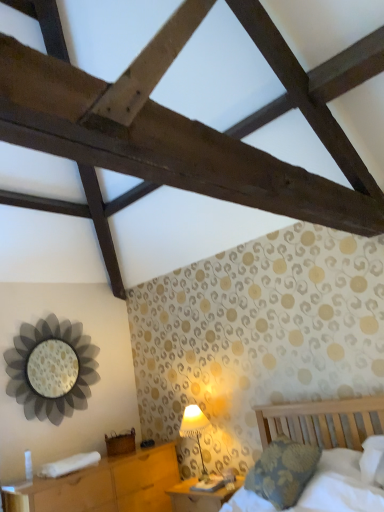
At what (x,y) coordinates should I click in order to perform the action: click on metallic flower-shaped mirror at left. Please return your answer as a coordinate pair (x, y). This screenshot has width=384, height=512. Looking at the image, I should click on pos(51,368).

What do you see at coordinates (51, 368) in the screenshot?
I see `metallic flower-shaped mirror at left` at bounding box center [51, 368].

What is the approximate height of wooden bed at lower right?

44.03 centimeters.

Where is `wooden nightstand at lower left, which appears as the first nightstand when viewed from the left`? wooden nightstand at lower left, which appears as the first nightstand when viewed from the left is located at coordinates (104, 486).

Identify the location of wooden nightstand at lower center, positioned as the 2th nightstand in left-to-right order. (200, 496).

Find the location of a particular element. white fabric lampshade at lower center is located at coordinates (195, 430).

Where is `metallic flower-shaped mirror at left`? metallic flower-shaped mirror at left is located at coordinates (51, 368).

Who is more distant, wooden nightstand at lower left, the 2th nightstand when ordered from right to left, or wooden bed at lower right?

wooden nightstand at lower left, the 2th nightstand when ordered from right to left, is further from the camera.

Who is smaller, wooden nightstand at lower left, the 2th nightstand when ordered from right to left, or wooden bed at lower right?

Smaller between the two is wooden bed at lower right.

How different are the orientations of wooden nightstand at lower left, the 2th nightstand when ordered from right to left, and wooden bed at lower right in degrees?

They differ by 99.2 degrees in their facing directions.

At what (x,y) coordinates should I click in order to perform the action: click on bed lying on the right of wooden nightstand at lower left, the 2th nightstand when ordered from right to left. Please return your answer as a coordinate pair (x, y). The width and height of the screenshot is (384, 512). Looking at the image, I should click on (330, 446).

Looking at the image, does wooden bed at lower right seem bigger or smaller compared to wooden nightstand at lower left, which appears as the first nightstand when viewed from the left?

Considering their sizes, wooden bed at lower right takes up less space than wooden nightstand at lower left, which appears as the first nightstand when viewed from the left.

Looking at their sizes, would you say wooden bed at lower right is wider or thinner than wooden nightstand at lower left, which appears as the first nightstand when viewed from the left?

In the image, wooden bed at lower right appears to be more narrow than wooden nightstand at lower left, which appears as the first nightstand when viewed from the left.

From a real-world perspective, is white fabric lampshade at lower center positioned over wooden nightstand at lower left, which appears as the first nightstand when viewed from the left, based on gravity?

Yes, from a real-world perspective, white fabric lampshade at lower center is above wooden nightstand at lower left, which appears as the first nightstand when viewed from the left.

Is white fabric lampshade at lower center positioned far away from wooden nightstand at lower left, the 2th nightstand when ordered from right to left?

white fabric lampshade at lower center is actually quite close to wooden nightstand at lower left, the 2th nightstand when ordered from right to left.

Identify the location of table lamp located behind the wooden nightstand at lower left, which appears as the first nightstand when viewed from the left. Image resolution: width=384 pixels, height=512 pixels. click(195, 430).

Based on their positions, is white fabric lampshade at lower center located to the left or right of wooden nightstand at lower left, the 2th nightstand when ordered from right to left?

From the image, it's evident that white fabric lampshade at lower center is to the right of wooden nightstand at lower left, the 2th nightstand when ordered from right to left.

Is metallic flower-shaped mirror at left oriented away from white fabric lampshade at lower center?

No.

Which is in front, point (70, 383) or point (203, 414)?

The point (203, 414) is in front.

In the image, is metallic flower-shaped mirror at left positioned in front of or behind white fabric lampshade at lower center?

In the image, metallic flower-shaped mirror at left appears behind white fabric lampshade at lower center.

Is metallic flower-shaped mirror at left next to white fabric lampshade at lower center?

No, metallic flower-shaped mirror at left is not with white fabric lampshade at lower center.

Where is `the 1st nightstand in front when counting from the white fabric lampshade at lower center`? This screenshot has width=384, height=512. the 1st nightstand in front when counting from the white fabric lampshade at lower center is located at coordinates (200, 496).

Can you tell me how much wooden nightstand at lower center, positioned as the 2th nightstand in left-to-right order, and white fabric lampshade at lower center differ in facing direction?

The facing directions of wooden nightstand at lower center, positioned as the 2th nightstand in left-to-right order, and white fabric lampshade at lower center are 0.789 degrees apart.

From a real-world perspective, between wooden nightstand at lower center, positioned as the 2th nightstand in left-to-right order, and white fabric lampshade at lower center, who is vertically higher?

In real-world perspective, white fabric lampshade at lower center is above.

Is wooden nightstand at lower center, positioned as the 2th nightstand in left-to-right order, oriented towards white fabric lampshade at lower center?

No, wooden nightstand at lower center, positioned as the 2th nightstand in left-to-right order, is not oriented towards white fabric lampshade at lower center.

Between white fabric lampshade at lower center and wooden nightstand at lower center, positioned as the 2th nightstand in left-to-right order, which one has more height?

Standing taller between the two is white fabric lampshade at lower center.

Considering the relative sizes of white fabric lampshade at lower center and wooden nightstand at lower center, which ranks as the 1th nightstand in right-to-left order, in the image provided, is white fabric lampshade at lower center bigger than wooden nightstand at lower center, which ranks as the 1th nightstand in right-to-left order,?

No.

Is point (193, 433) farther from camera compared to point (203, 500)?

Yes, point (193, 433) is farther from viewer.

Is white fabric lampshade at lower center not close to wooden nightstand at lower center, which ranks as the 1th nightstand in right-to-left order?

No.

Does wooden bed at lower right have a greater height compared to wooden nightstand at lower center, positioned as the 2th nightstand in left-to-right order?

Yes, wooden bed at lower right is taller than wooden nightstand at lower center, positioned as the 2th nightstand in left-to-right order.

Does point (223, 506) come farther from viewer compared to point (192, 484)?

No, it is in front of (192, 484).

From a real-world perspective, who is located higher, wooden bed at lower right or wooden nightstand at lower center, positioned as the 2th nightstand in left-to-right order?

wooden bed at lower right, from a real-world perspective.

Is wooden bed at lower right aimed at wooden nightstand at lower center, which ranks as the 1th nightstand in right-to-left order?

No, wooden bed at lower right does not turn towards wooden nightstand at lower center, which ranks as the 1th nightstand in right-to-left order.

Locate an element on the screen. nightstand that is the 2nd one when counting downward from the wooden bed at lower right (from the image's perspective) is located at coordinates (104, 486).

Locate an element on the screen. the 1st nightstand behind when counting from the wooden bed at lower right is located at coordinates (104, 486).

Considering their positions, is white fabric lampshade at lower center positioned further to wooden nightstand at lower center, positioned as the 2th nightstand in left-to-right order, than wooden bed at lower right?

Based on the image, wooden bed at lower right appears to be further to wooden nightstand at lower center, positioned as the 2th nightstand in left-to-right order.

From the image, which object appears to be nearer to wooden nightstand at lower left, which appears as the first nightstand when viewed from the left, wooden bed at lower right or metallic flower-shaped mirror at left?

Based on the image, metallic flower-shaped mirror at left appears to be nearer to wooden nightstand at lower left, which appears as the first nightstand when viewed from the left.

Considering their positions, is metallic flower-shaped mirror at left positioned closer to wooden bed at lower right than wooden nightstand at lower left, which appears as the first nightstand when viewed from the left?

wooden nightstand at lower left, which appears as the first nightstand when viewed from the left.

Based on their spatial positions, is wooden nightstand at lower left, which appears as the first nightstand when viewed from the left, or wooden bed at lower right closer to wooden nightstand at lower center, positioned as the 2th nightstand in left-to-right order?

wooden nightstand at lower left, which appears as the first nightstand when viewed from the left, lies closer to wooden nightstand at lower center, positioned as the 2th nightstand in left-to-right order, than the other object.

Looking at the image, which one is located closer to white fabric lampshade at lower center, wooden nightstand at lower left, the 2th nightstand when ordered from right to left, or wooden bed at lower right?

wooden nightstand at lower left, the 2th nightstand when ordered from right to left, lies closer to white fabric lampshade at lower center than the other object.

Based on their spatial positions, is wooden nightstand at lower center, which ranks as the 1th nightstand in right-to-left order, or wooden bed at lower right further from metallic flower-shaped mirror at left?

wooden bed at lower right is positioned further to the anchor metallic flower-shaped mirror at left.

Based on their spatial positions, is white fabric lampshade at lower center or metallic flower-shaped mirror at left further from wooden bed at lower right?

Among the two, metallic flower-shaped mirror at left is located further to wooden bed at lower right.

Looking at this image, estimate the real-world distances between objects in this image. Which object is closer to metallic flower-shaped mirror at left, white fabric lampshade at lower center or wooden nightstand at lower center, which ranks as the 1th nightstand in right-to-left order?

Among the two, white fabric lampshade at lower center is located nearer to metallic flower-shaped mirror at left.

I want to click on table lamp located between metallic flower-shaped mirror at left and wooden bed at lower right in the left-right direction, so click(x=195, y=430).

At what (x,y) coordinates should I click in order to perform the action: click on nightstand between wooden nightstand at lower left, which appears as the first nightstand when viewed from the left, and wooden bed at lower right. Please return your answer as a coordinate pair (x, y). The width and height of the screenshot is (384, 512). Looking at the image, I should click on (200, 496).

Identify the location of table lamp between wooden nightstand at lower left, which appears as the first nightstand when viewed from the left, and wooden nightstand at lower center, positioned as the 2th nightstand in left-to-right order, in the horizontal direction. This screenshot has height=512, width=384. (195, 430).

Find the location of a particular element. The image size is (384, 512). nightstand between metallic flower-shaped mirror at left and white fabric lampshade at lower center in the horizontal direction is located at coordinates (104, 486).